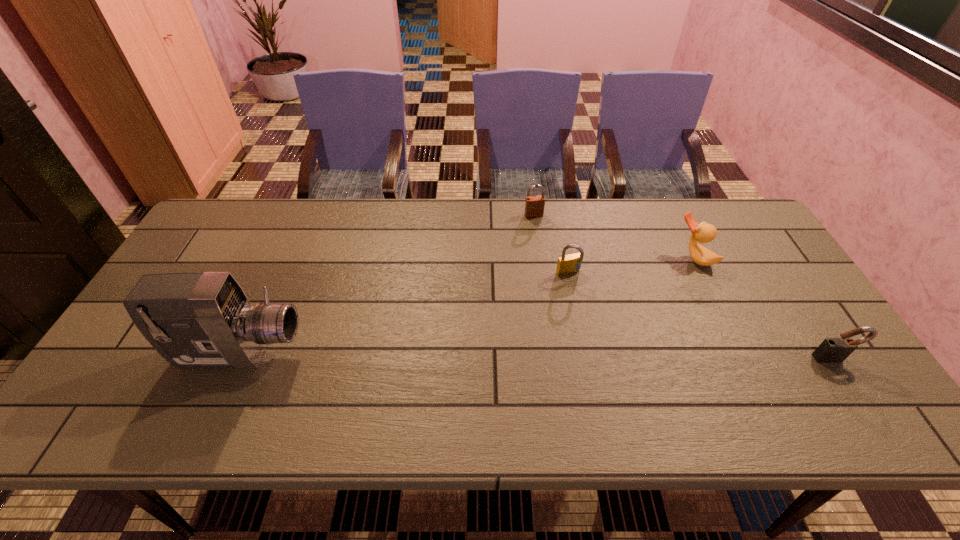
Locate an element on the screen. The width and height of the screenshot is (960, 540). vacant space on the desktop that is between the tallest object and the rightmost padlock and is positioned on the front-facing side of the farthest object is located at coordinates (593, 356).

What are the coordinates of `vacant space on the desktop that is between the leftmost object and the nearest padlock and is positioned on the beak of the duck` in the screenshot? It's located at (574, 356).

The image size is (960, 540). I want to click on free space on the desktop that is between the camcorder and the rightmost padlock and is positioned on the side with the combination dials of the second farthest padlock, so click(x=622, y=356).